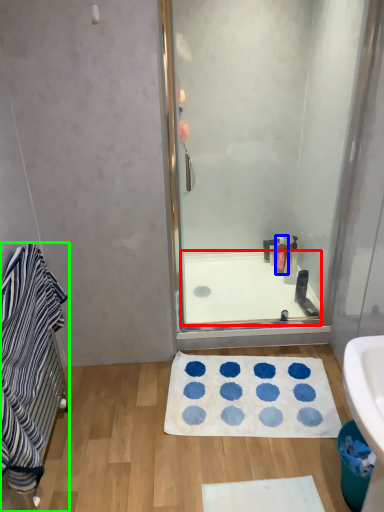
Question: Which object is positioned farthest from bath (highlighted by a red box)? Select from toiletry (highlighted by a blue box) and bathroom cabinet (highlighted by a green box).

Choices:
 (A) toiletry
 (B) bathroom cabinet

Answer: (B)